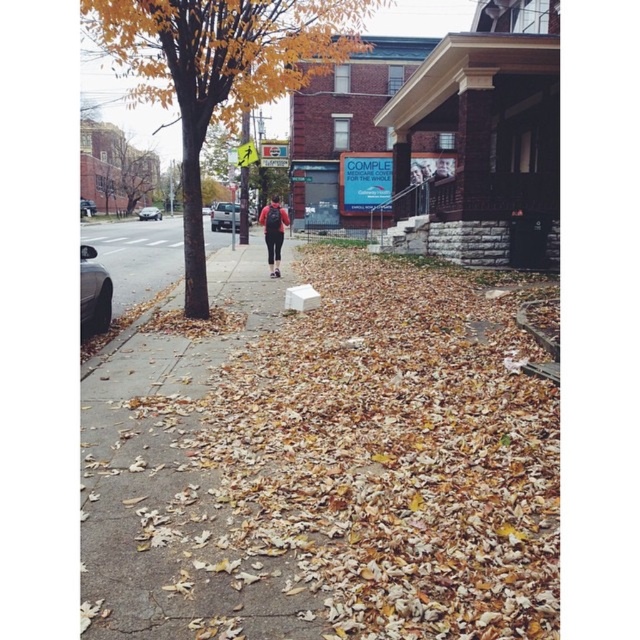
Is point (83, 3) closer to camera compared to point (276, 260)?

That is True.

The image size is (640, 640). Find the location of `yellow leafy tree at center`. yellow leafy tree at center is located at coordinates (218, 72).